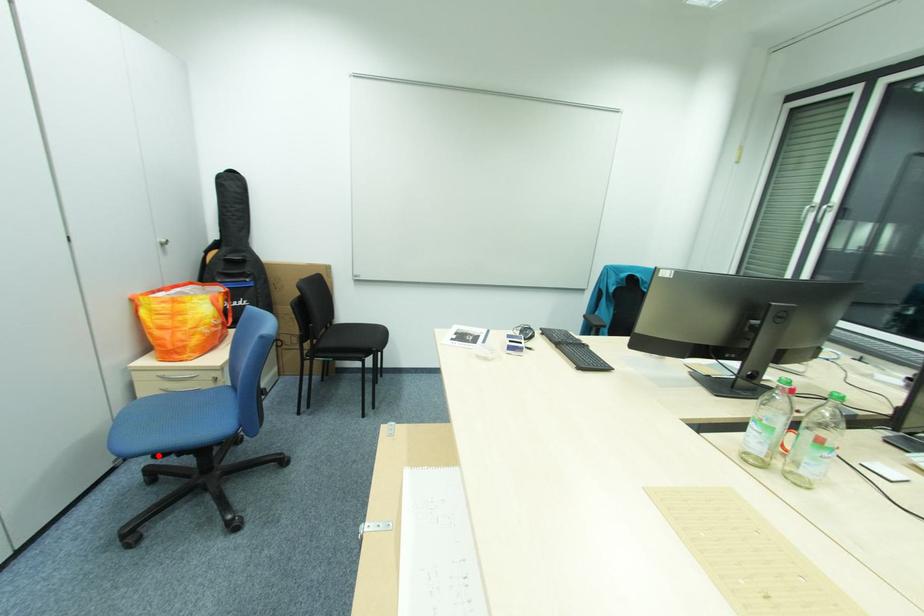
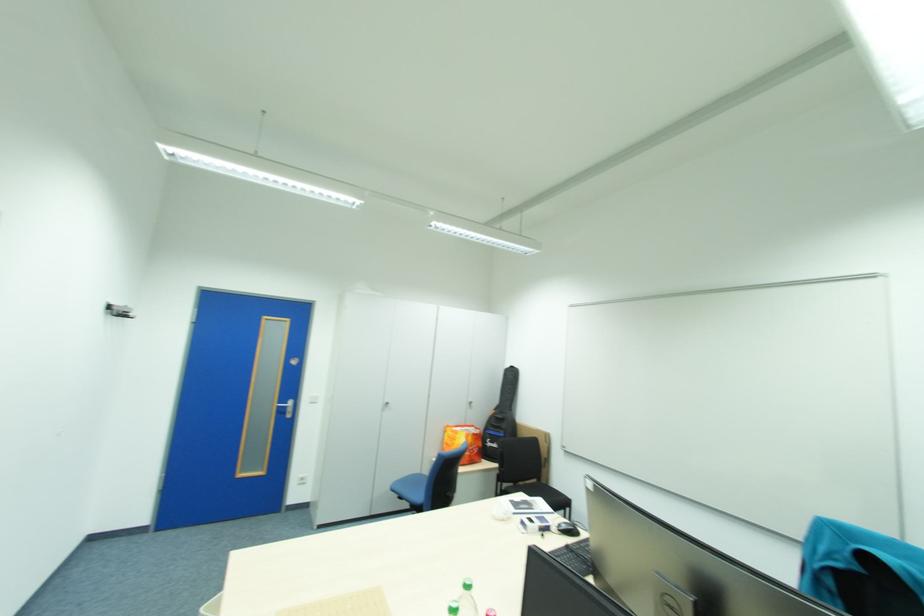
Question: A red point is marked in image1. In image2, is the corresponding 3D point closer to the camera or farther? Reply with the corresponding letter.

Choices:
 (A) The corresponding 3D point is closer.
 (B) The corresponding 3D point is farther.

Answer: (B)